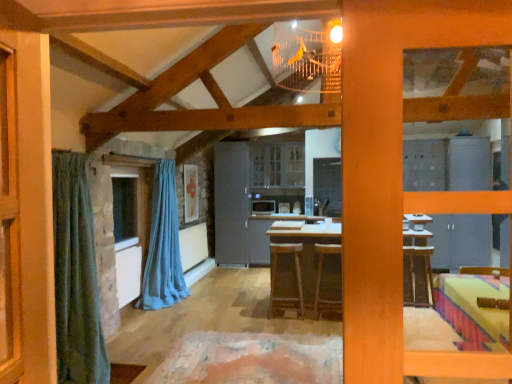
At what (x,y) coordinates should I click in order to perform the action: click on vacant space in brown wooden stool at center, which ranks as the 2th stool in right-to-left order (from a real-world perspective). Please return your answer as a coordinate pair (x, y). This screenshot has height=384, width=512. Looking at the image, I should click on [284, 314].